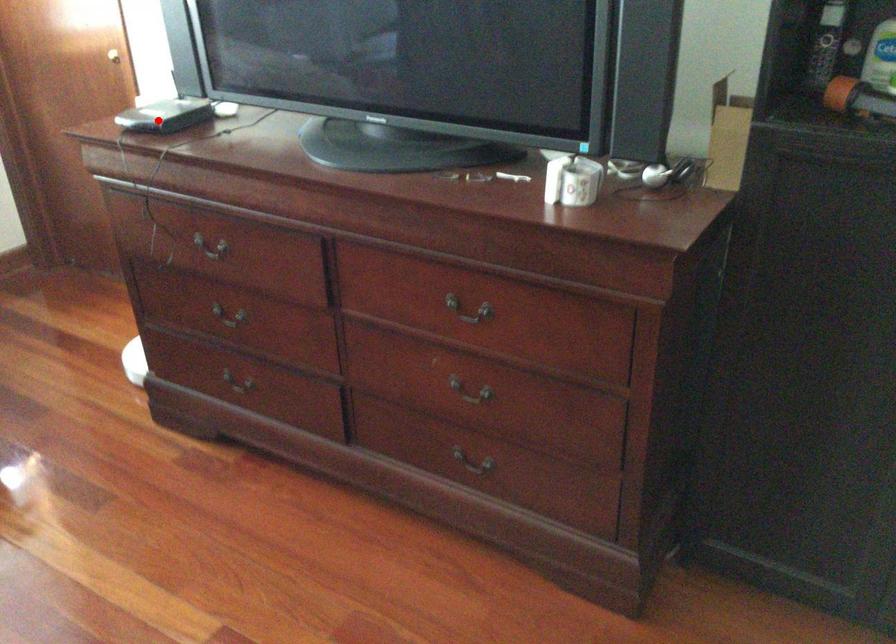
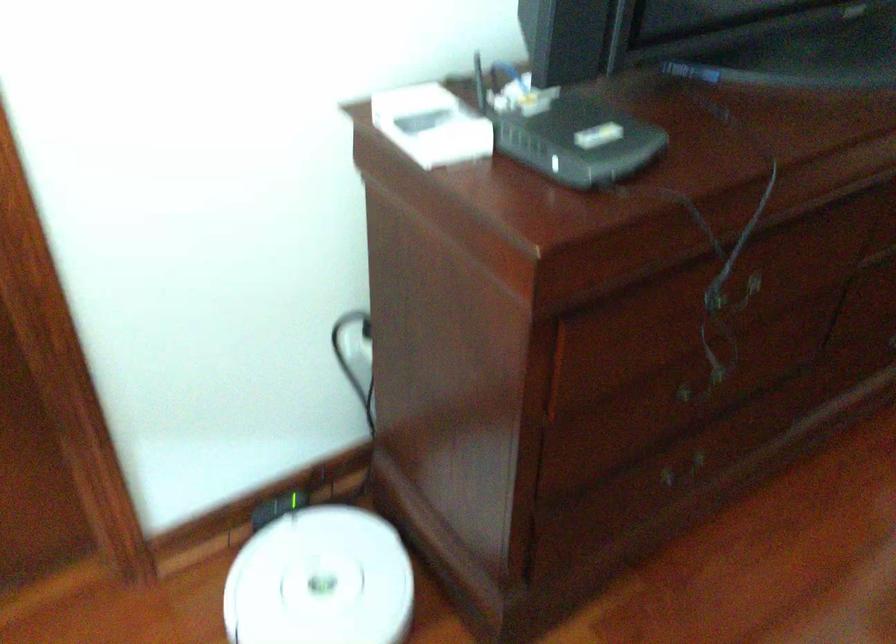
Find the pixel in the second image that matches the highlighted location in the first image.

(569, 134)